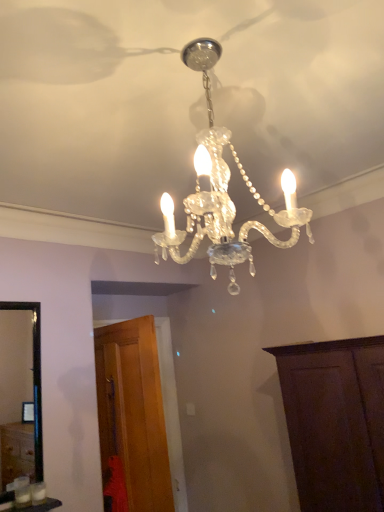
Describe the element at coordinates (330, 423) in the screenshot. Image resolution: width=384 pixels, height=512 pixels. I see `dark wood cabinet at lower right, which is counted as the first cabinetry, starting from the right` at that location.

The width and height of the screenshot is (384, 512). Describe the element at coordinates (222, 192) in the screenshot. I see `clear crystal chandelier at center` at that location.

What do you see at coordinates (133, 412) in the screenshot? I see `wooden door at lower left, the first cabinetry viewed from the left` at bounding box center [133, 412].

Where is `dark wood cabinet at lower right, the 2th cabinetry when ordered from left to right`? Image resolution: width=384 pixels, height=512 pixels. dark wood cabinet at lower right, the 2th cabinetry when ordered from left to right is located at coordinates (330, 423).

Is clear crystal chandelier at center positioned beyond the bounds of dark wood cabinet at lower right, the 2th cabinetry when ordered from left to right?

Yes.

Is clear crystal chandelier at center to the left of dark wood cabinet at lower right, which is counted as the first cabinetry, starting from the right, from the viewer's perspective?

Yes.

Considering the positions of objects clear crystal chandelier at center and dark wood cabinet at lower right, the 2th cabinetry when ordered from left to right, in the image provided, who is behind, clear crystal chandelier at center or dark wood cabinet at lower right, the 2th cabinetry when ordered from left to right,?

dark wood cabinet at lower right, the 2th cabinetry when ordered from left to right.

Can you confirm if clear crystal chandelier at center is bigger than dark wood cabinet at lower right, the 2th cabinetry when ordered from left to right?

Incorrect, clear crystal chandelier at center is not larger than dark wood cabinet at lower right, the 2th cabinetry when ordered from left to right.

Considering the positions of point (369, 478) and point (121, 409), is point (369, 478) closer or farther from the camera than point (121, 409)?

Point (369, 478) is closer to the camera than point (121, 409).

In the scene shown: Is dark wood cabinet at lower right, the 2th cabinetry when ordered from left to right, at the right side of wooden door at lower left, acting as the 2th cabinetry starting from the right?

Correct, you'll find dark wood cabinet at lower right, the 2th cabinetry when ordered from left to right, to the right of wooden door at lower left, acting as the 2th cabinetry starting from the right.

Between dark wood cabinet at lower right, the 2th cabinetry when ordered from left to right, and wooden door at lower left, acting as the 2th cabinetry starting from the right, which one is positioned in front?

dark wood cabinet at lower right, the 2th cabinetry when ordered from left to right, is closer to the camera.

You are a GUI agent. You are given a task and a screenshot of the screen. Output one action in this format:
    pyautogui.click(x=<x>, y=<y>)
    Task: Click on the 2nd cabinetry directly beneath the clear crystal chandelier at center (from a real-world perspective)
    
    Given the screenshot: What is the action you would take?
    pyautogui.click(x=330, y=423)

Is dark wood cabinet at lower right, the 2th cabinetry when ordered from left to right, wider or thinner than clear crystal chandelier at center?

In the image, dark wood cabinet at lower right, the 2th cabinetry when ordered from left to right, appears to be wider than clear crystal chandelier at center.

From the image's perspective, relative to clear crystal chandelier at center, is dark wood cabinet at lower right, which is counted as the first cabinetry, starting from the right, above or below?

Clearly, from the image's perspective, dark wood cabinet at lower right, which is counted as the first cabinetry, starting from the right, is below clear crystal chandelier at center.

From a real-world perspective, is dark wood cabinet at lower right, the 2th cabinetry when ordered from left to right, on clear crystal chandelier at center?

No, from a real-world perspective, dark wood cabinet at lower right, the 2th cabinetry when ordered from left to right, is not above clear crystal chandelier at center.

Looking at this image, considering the positions of objects wooden door at lower left, the first cabinetry viewed from the left, and clear crystal chandelier at center in the image provided, who is more to the left, wooden door at lower left, the first cabinetry viewed from the left, or clear crystal chandelier at center?

From the viewer's perspective, wooden door at lower left, the first cabinetry viewed from the left, appears more on the left side.

Find the location of `the 1st cabinetry below the clear crystal chandelier at center (from a real-world perspective)`. the 1st cabinetry below the clear crystal chandelier at center (from a real-world perspective) is located at coordinates (133, 412).

Is wooden door at lower left, the first cabinetry viewed from the left, far from clear crystal chandelier at center?

Absolutely, wooden door at lower left, the first cabinetry viewed from the left, is distant from clear crystal chandelier at center.

Does wooden door at lower left, the first cabinetry viewed from the left, have a greater width compared to dark wood cabinet at lower right, the 2th cabinetry when ordered from left to right?

Incorrect, the width of wooden door at lower left, the first cabinetry viewed from the left, does not surpass that of dark wood cabinet at lower right, the 2th cabinetry when ordered from left to right.

From the image's perspective, is wooden door at lower left, the first cabinetry viewed from the left, on top of dark wood cabinet at lower right, the 2th cabinetry when ordered from left to right?

Actually, wooden door at lower left, the first cabinetry viewed from the left, appears below dark wood cabinet at lower right, the 2th cabinetry when ordered from left to right, in the image.

Locate an element on the screen. Image resolution: width=384 pixels, height=512 pixels. cabinetry that appears below the wooden door at lower left, acting as the 2th cabinetry starting from the right (from a real-world perspective) is located at coordinates (330, 423).

Is wooden door at lower left, acting as the 2th cabinetry starting from the right, positioned far away from dark wood cabinet at lower right, the 2th cabinetry when ordered from left to right?

wooden door at lower left, acting as the 2th cabinetry starting from the right, is actually quite close to dark wood cabinet at lower right, the 2th cabinetry when ordered from left to right.

Is clear crystal chandelier at center to the left or to the right of wooden door at lower left, acting as the 2th cabinetry starting from the right, in the image?

From the image, it's evident that clear crystal chandelier at center is to the right of wooden door at lower left, acting as the 2th cabinetry starting from the right.

Is clear crystal chandelier at center positioned with its back to wooden door at lower left, acting as the 2th cabinetry starting from the right?

No, wooden door at lower left, acting as the 2th cabinetry starting from the right, is not at the back of clear crystal chandelier at center.

Considering the sizes of objects clear crystal chandelier at center and wooden door at lower left, the first cabinetry viewed from the left, in the image provided, who is smaller, clear crystal chandelier at center or wooden door at lower left, the first cabinetry viewed from the left,?

With smaller size is clear crystal chandelier at center.

From the image's perspective, which one is positioned lower, clear crystal chandelier at center or wooden door at lower left, the first cabinetry viewed from the left?

wooden door at lower left, the first cabinetry viewed from the left, appears lower in the image.

At what (x,y) coordinates should I click in order to perform the action: click on cabinetry that is the 2nd one below the clear crystal chandelier at center (from a real-world perspective). Please return your answer as a coordinate pair (x, y). This screenshot has height=512, width=384. Looking at the image, I should click on (330, 423).

There is a dark wood cabinet at lower right, the 2th cabinetry when ordered from left to right. Find the location of `cabinetry above it (from a real-world perspective)`. cabinetry above it (from a real-world perspective) is located at coordinates (133, 412).

Considering their positions, is wooden door at lower left, the first cabinetry viewed from the left, positioned closer to clear crystal chandelier at center than dark wood cabinet at lower right, the 2th cabinetry when ordered from left to right?

dark wood cabinet at lower right, the 2th cabinetry when ordered from left to right, is closer to clear crystal chandelier at center.

Looking at the image, which one is located further to wooden door at lower left, acting as the 2th cabinetry starting from the right, clear crystal chandelier at center or dark wood cabinet at lower right, which is counted as the first cabinetry, starting from the right?

clear crystal chandelier at center is further to wooden door at lower left, acting as the 2th cabinetry starting from the right.

From the image, which object appears to be nearer to dark wood cabinet at lower right, the 2th cabinetry when ordered from left to right, wooden door at lower left, the first cabinetry viewed from the left, or clear crystal chandelier at center?

The object closer to dark wood cabinet at lower right, the 2th cabinetry when ordered from left to right, is wooden door at lower left, the first cabinetry viewed from the left.

Estimate the real-world distances between objects in this image. Which object is closer to dark wood cabinet at lower right, which is counted as the first cabinetry, starting from the right, clear crystal chandelier at center or wooden door at lower left, the first cabinetry viewed from the left?

wooden door at lower left, the first cabinetry viewed from the left.

Estimate the real-world distances between objects in this image. Which object is further from wooden door at lower left, acting as the 2th cabinetry starting from the right, dark wood cabinet at lower right, which is counted as the first cabinetry, starting from the right, or clear crystal chandelier at center?

Based on the image, clear crystal chandelier at center appears to be further to wooden door at lower left, acting as the 2th cabinetry starting from the right.

Which object lies further to the anchor point clear crystal chandelier at center, dark wood cabinet at lower right, the 2th cabinetry when ordered from left to right, or wooden door at lower left, acting as the 2th cabinetry starting from the right?

wooden door at lower left, acting as the 2th cabinetry starting from the right, is further to clear crystal chandelier at center.

The image size is (384, 512). I want to click on cabinetry between clear crystal chandelier at center and wooden door at lower left, acting as the 2th cabinetry starting from the right, from top to bottom, so click(x=330, y=423).